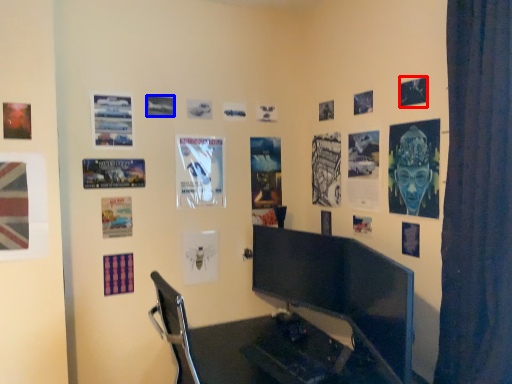
Question: Among these objects, which one is nearest to the camera, poster page (highlighted by a red box) or poster page (highlighted by a blue box)?

Choices:
 (A) poster page
 (B) poster page

Answer: (A)